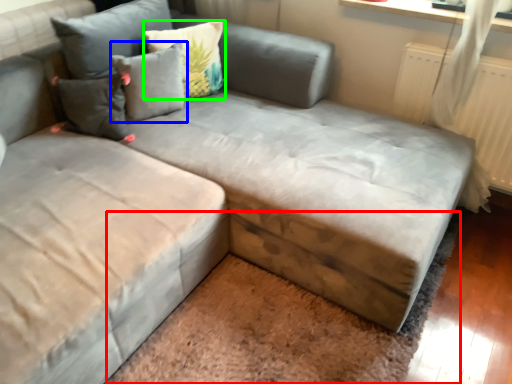
Question: Which object is the farthest from mat (highlighted by a red box)? Choose among these: pillow (highlighted by a blue box) or pillow (highlighted by a green box).

Choices:
 (A) pillow
 (B) pillow

Answer: (B)